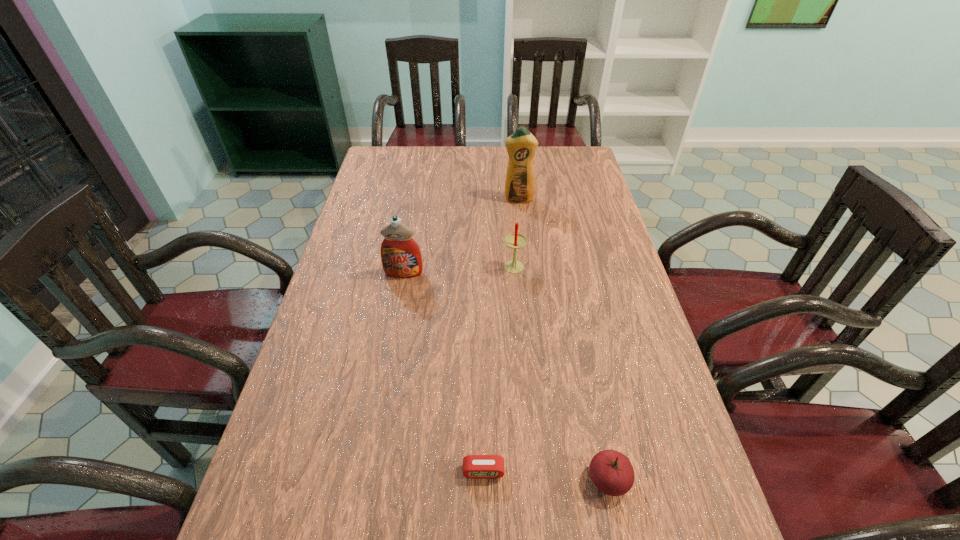
The width and height of the screenshot is (960, 540). I want to click on the tallest object, so click(x=521, y=146).

In order to click on the farther detergent in this screenshot , I will do `click(521, 146)`.

Locate an element on the screen. This screenshot has width=960, height=540. the left detergent is located at coordinates (401, 257).

The height and width of the screenshot is (540, 960). Find the location of `the leftmost object`. the leftmost object is located at coordinates (401, 257).

Locate an element on the screen. This screenshot has height=540, width=960. candle is located at coordinates (514, 240).

Where is `tomato`? The image size is (960, 540). tomato is located at coordinates (612, 473).

Where is `the fourth tallest object`? This screenshot has height=540, width=960. the fourth tallest object is located at coordinates (612, 473).

The image size is (960, 540). I want to click on alarm clock, so click(x=474, y=466).

The width and height of the screenshot is (960, 540). Find the location of `the shortest object`. the shortest object is located at coordinates (474, 466).

Identify the location of free location located on the label of the farthest object. (528, 282).